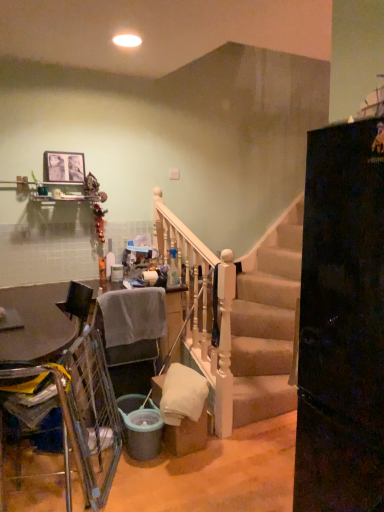
What is the approximate height of yellow fabric armchair at lower left, which is the first armchair in front-to-back order?

The height of yellow fabric armchair at lower left, which is the first armchair in front-to-back order, is 4.97 inches.

Describe the element at coordinates (63, 167) in the screenshot. Image resolution: width=384 pixels, height=512 pixels. I see `matte wooden picture frame at upper left` at that location.

Locate an element on the screen. Image resolution: width=384 pixels, height=512 pixels. metallic silver table at lower left is located at coordinates [37, 324].

Is yellow fabric armchair at lower left, which ranks as the second armchair in back-to-front order, further to the viewer compared to matte wooden picture frame at upper left?

No, yellow fabric armchair at lower left, which ranks as the second armchair in back-to-front order, is in front of matte wooden picture frame at upper left.

From the image's perspective, is yellow fabric armchair at lower left, which is the first armchair in front-to-back order, above or below matte wooden picture frame at upper left?

yellow fabric armchair at lower left, which is the first armchair in front-to-back order, is situated lower than matte wooden picture frame at upper left in the image.

How many degrees apart are the facing directions of yellow fabric armchair at lower left, which ranks as the second armchair in back-to-front order, and matte wooden picture frame at upper left?

There is a 179-degree angle between the facing directions of yellow fabric armchair at lower left, which ranks as the second armchair in back-to-front order, and matte wooden picture frame at upper left.

Is yellow fabric armchair at lower left, which ranks as the second armchair in back-to-front order, positioned far away from matte wooden picture frame at upper left?

Yes, yellow fabric armchair at lower left, which ranks as the second armchair in back-to-front order, and matte wooden picture frame at upper left are located far from each other.

Which is nearer, (57,164) or (148,346)?

Point (57,164) appears to be farther away from the viewer than point (148,346).

What's the angular difference between matte wooden picture frame at upper left and gray fabric chair at lower left, arranged as the 2th armchair when viewed from the front,'s facing directions?

There is a 1.13-degree angle between the facing directions of matte wooden picture frame at upper left and gray fabric chair at lower left, arranged as the 2th armchair when viewed from the front.

Can you confirm if matte wooden picture frame at upper left is positioned to the right of gray fabric chair at lower left, which ranks as the first armchair in back-to-front order?

In fact, matte wooden picture frame at upper left is to the left of gray fabric chair at lower left, which ranks as the first armchair in back-to-front order.

Consider the image. Between matte wooden picture frame at upper left and gray fabric chair at lower left, arranged as the 2th armchair when viewed from the front, which one has smaller size?

matte wooden picture frame at upper left is smaller.

Is gray fabric chair at lower left, arranged as the 2th armchair when viewed from the front, inside or outside of metallic silver table at lower left?

The correct answer is: outside.

Does gray fabric chair at lower left, arranged as the 2th armchair when viewed from the front, have a lesser width compared to metallic silver table at lower left?

Correct, the width of gray fabric chair at lower left, arranged as the 2th armchair when viewed from the front, is less than that of metallic silver table at lower left.

Image resolution: width=384 pixels, height=512 pixels. I want to click on armchair behind the metallic silver table at lower left, so click(131, 336).

Considering the relative sizes of gray fabric chair at lower left, which ranks as the first armchair in back-to-front order, and metallic silver table at lower left in the image provided, is gray fabric chair at lower left, which ranks as the first armchair in back-to-front order, bigger than metallic silver table at lower left?

Incorrect, gray fabric chair at lower left, which ranks as the first armchair in back-to-front order, is not larger than metallic silver table at lower left.

Does point (71, 163) lie in front of point (65, 297)?

No, it is behind (65, 297).

Is matte wooden picture frame at upper left aimed at metallic silver table at lower left?

No.

Which is correct: matte wooden picture frame at upper left is inside metallic silver table at lower left, or outside of it?

matte wooden picture frame at upper left is spatially situated outside metallic silver table at lower left.

In the image, is matte wooden picture frame at upper left positioned in front of or behind metallic silver table at lower left?

Clearly, matte wooden picture frame at upper left is behind metallic silver table at lower left.

Would you say metallic silver table at lower left is inside or outside gray fabric chair at lower left, which ranks as the first armchair in back-to-front order?

metallic silver table at lower left exists outside the volume of gray fabric chair at lower left, which ranks as the first armchair in back-to-front order.

Is metallic silver table at lower left not near gray fabric chair at lower left, which ranks as the first armchair in back-to-front order?

No, metallic silver table at lower left is in close proximity to gray fabric chair at lower left, which ranks as the first armchair in back-to-front order.

Looking at this image, which of these two, metallic silver table at lower left or gray fabric chair at lower left, which ranks as the first armchair in back-to-front order, stands shorter?

gray fabric chair at lower left, which ranks as the first armchair in back-to-front order, is shorter.

Is point (49, 321) positioned in front of point (113, 375)?

Yes, it is.

Can you confirm if gray fabric chair at lower left, which ranks as the first armchair in back-to-front order, is taller than matte wooden picture frame at upper left?

Yes.

Considering the sizes of objects gray fabric chair at lower left, which ranks as the first armchair in back-to-front order, and matte wooden picture frame at upper left in the image provided, who is bigger, gray fabric chair at lower left, which ranks as the first armchair in back-to-front order, or matte wooden picture frame at upper left?

gray fabric chair at lower left, which ranks as the first armchair in back-to-front order, is bigger.

In the scene shown: Which object is positioned more to the right, gray fabric chair at lower left, which ranks as the first armchair in back-to-front order, or matte wooden picture frame at upper left?

gray fabric chair at lower left, which ranks as the first armchair in back-to-front order, is more to the right.

Is matte wooden picture frame at upper left completely or partially inside gray fabric chair at lower left, which ranks as the first armchair in back-to-front order?

Definitely not — matte wooden picture frame at upper left is not inside gray fabric chair at lower left, which ranks as the first armchair in back-to-front order.

From the image's perspective, is matte wooden picture frame at upper left positioned above or below yellow fabric armchair at lower left, which ranks as the second armchair in back-to-front order?

From the image's perspective, matte wooden picture frame at upper left appears above yellow fabric armchair at lower left, which ranks as the second armchair in back-to-front order.

Could you tell me if matte wooden picture frame at upper left is turned towards yellow fabric armchair at lower left, which is the first armchair in front-to-back order?

No, matte wooden picture frame at upper left is not aimed at yellow fabric armchair at lower left, which is the first armchair in front-to-back order.

Would you say matte wooden picture frame at upper left is to the left or to the right of yellow fabric armchair at lower left, which is the first armchair in front-to-back order, in the picture?

Clearly, matte wooden picture frame at upper left is on the left of yellow fabric armchair at lower left, which is the first armchair in front-to-back order, in the image.

Does matte wooden picture frame at upper left have a lesser height compared to yellow fabric armchair at lower left, which ranks as the second armchair in back-to-front order?

No, matte wooden picture frame at upper left is not shorter than yellow fabric armchair at lower left, which ranks as the second armchair in back-to-front order.

This screenshot has width=384, height=512. What are the coordinates of `picture frame above the yellow fabric armchair at lower left, which ranks as the second armchair in back-to-front order (from the image's perspective)` in the screenshot? It's located at (63, 167).

The image size is (384, 512). I want to click on picture frame behind the gray fabric chair at lower left, which ranks as the first armchair in back-to-front order, so click(63, 167).

Which object lies nearer to the anchor point matte wooden picture frame at upper left, yellow fabric armchair at lower left, which ranks as the second armchair in back-to-front order, or metallic silver table at lower left?

Based on the image, metallic silver table at lower left appears to be nearer to matte wooden picture frame at upper left.

From the image, which object appears to be nearer to metallic silver table at lower left, yellow fabric armchair at lower left, which is the first armchair in front-to-back order, or gray fabric chair at lower left, arranged as the 2th armchair when viewed from the front?

yellow fabric armchair at lower left, which is the first armchair in front-to-back order, is closer to metallic silver table at lower left.

Estimate the real-world distances between objects in this image. Which object is further from yellow fabric armchair at lower left, which ranks as the second armchair in back-to-front order, matte wooden picture frame at upper left or metallic silver table at lower left?

Among the two, matte wooden picture frame at upper left is located further to yellow fabric armchair at lower left, which ranks as the second armchair in back-to-front order.

Considering their positions, is metallic silver table at lower left positioned closer to matte wooden picture frame at upper left than yellow fabric armchair at lower left, which ranks as the second armchair in back-to-front order?

Among the two, metallic silver table at lower left is located nearer to matte wooden picture frame at upper left.

From the image, which object appears to be farther from metallic silver table at lower left, yellow fabric armchair at lower left, which is the first armchair in front-to-back order, or matte wooden picture frame at upper left?

matte wooden picture frame at upper left is further to metallic silver table at lower left.

Estimate the real-world distances between objects in this image. Which object is further from metallic silver table at lower left, gray fabric chair at lower left, which ranks as the first armchair in back-to-front order, or yellow fabric armchair at lower left, which ranks as the second armchair in back-to-front order?

Among the two, gray fabric chair at lower left, which ranks as the first armchair in back-to-front order, is located further to metallic silver table at lower left.

Looking at this image, based on their spatial positions, is gray fabric chair at lower left, arranged as the 2th armchair when viewed from the front, or matte wooden picture frame at upper left closer to metallic silver table at lower left?

gray fabric chair at lower left, arranged as the 2th armchair when viewed from the front.

Considering their positions, is matte wooden picture frame at upper left positioned closer to yellow fabric armchair at lower left, which is the first armchair in front-to-back order, than gray fabric chair at lower left, arranged as the 2th armchair when viewed from the front?

gray fabric chair at lower left, arranged as the 2th armchair when viewed from the front, is closer to yellow fabric armchair at lower left, which is the first armchair in front-to-back order.

This screenshot has width=384, height=512. What are the coordinates of `table positioned between yellow fabric armchair at lower left, which is the first armchair in front-to-back order, and gray fabric chair at lower left, which ranks as the first armchair in back-to-front order, from near to far` in the screenshot? It's located at (37, 324).

This screenshot has height=512, width=384. In order to click on armchair between yellow fabric armchair at lower left, which is the first armchair in front-to-back order, and matte wooden picture frame at upper left, along the z-axis in this screenshot , I will do `click(131, 336)`.